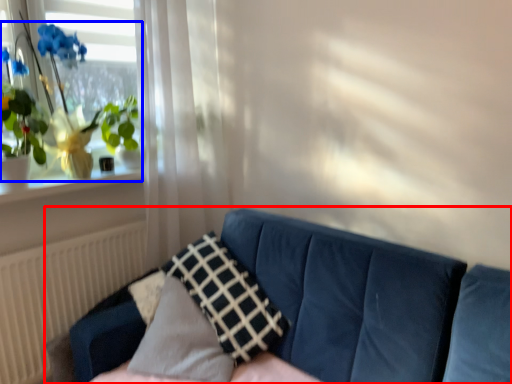
Question: Which object appears closest to the camera in this image, studio couch (highlighted by a red box) or houseplant (highlighted by a blue box)?

Choices:
 (A) studio couch
 (B) houseplant

Answer: (A)